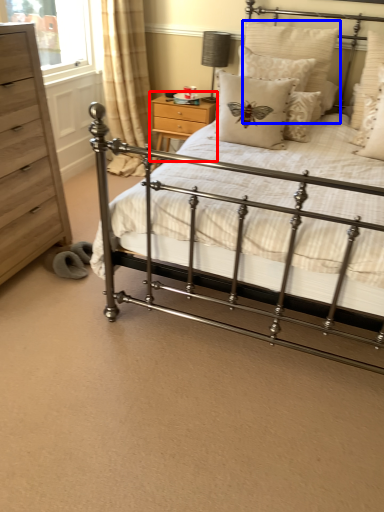
Question: Which object is closer to the camera taking this photo, nightstand (highlighted by a red box) or pillow (highlighted by a blue box)?

Choices:
 (A) nightstand
 (B) pillow

Answer: (B)